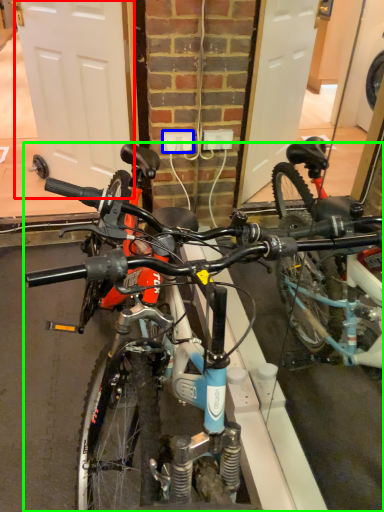
Question: Which object is positioned closest to garage door (highlighted by a red box)? Select from power outlet (highlighted by a blue box) and bicycle (highlighted by a green box).

Choices:
 (A) power outlet
 (B) bicycle

Answer: (A)